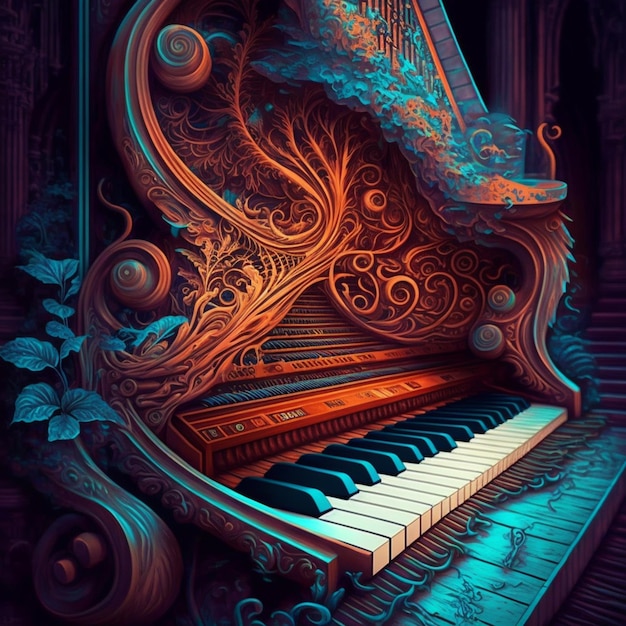
Locate an element on the screen. Image resolution: width=626 pixels, height=626 pixels. keyboard is located at coordinates (416, 499).